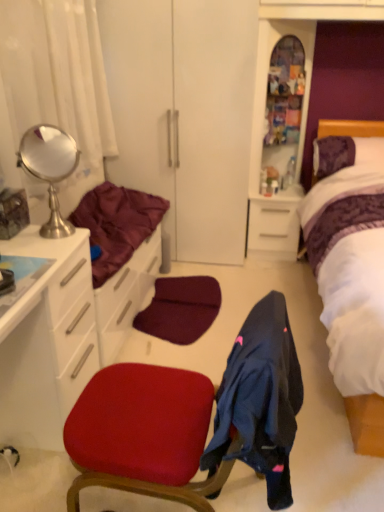
Question: Can you confirm if polished silver mirror at upper left is smaller than purple fabric headboard at upper right?

Choices:
 (A) no
 (B) yes

Answer: (B)

Question: Is polished silver mirror at upper left not near purple fabric headboard at upper right?

Choices:
 (A) yes
 (B) no

Answer: (A)

Question: From a real-world perspective, is polished silver mirror at upper left located beneath purple fabric headboard at upper right?

Choices:
 (A) no
 (B) yes

Answer: (A)

Question: Is polished silver mirror at upper left positioned with its back to purple fabric headboard at upper right?

Choices:
 (A) no
 (B) yes

Answer: (A)

Question: Is polished silver mirror at upper left oriented towards purple fabric headboard at upper right?

Choices:
 (A) no
 (B) yes

Answer: (A)

Question: Is polished silver mirror at upper left to the right of purple fabric headboard at upper right from the viewer's perspective?

Choices:
 (A) no
 (B) yes

Answer: (A)

Question: Considering the relative positions of polished silver mirror at upper left and maroon satin blanket at left in the image provided, is polished silver mirror at upper left in front of maroon satin blanket at left?

Choices:
 (A) no
 (B) yes

Answer: (B)

Question: Is polished silver mirror at upper left shorter than maroon satin blanket at left?

Choices:
 (A) yes
 (B) no

Answer: (B)

Question: Would you say polished silver mirror at upper left is outside maroon satin blanket at left?

Choices:
 (A) no
 (B) yes

Answer: (B)

Question: Can you confirm if polished silver mirror at upper left is positioned to the left of maroon satin blanket at left?

Choices:
 (A) yes
 (B) no

Answer: (A)

Question: Is polished silver mirror at upper left at the right side of maroon satin blanket at left?

Choices:
 (A) no
 (B) yes

Answer: (A)

Question: From a real-world perspective, is polished silver mirror at upper left on maroon satin blanket at left?

Choices:
 (A) no
 (B) yes

Answer: (B)

Question: Is white glossy cabinet at left wider than purple fabric headboard at upper right?

Choices:
 (A) yes
 (B) no

Answer: (A)